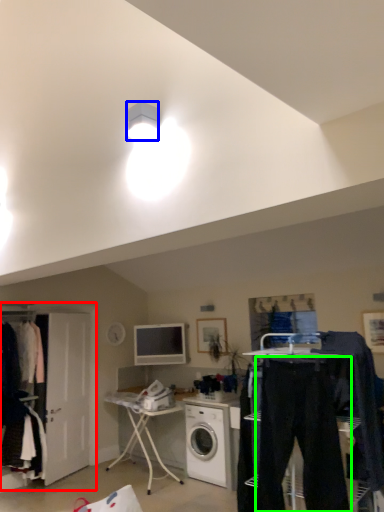
Question: Which is farther away from closet (highlighted by a red box)? lamp (highlighted by a blue box) or trousers (highlighted by a green box)?

Choices:
 (A) lamp
 (B) trousers

Answer: (A)